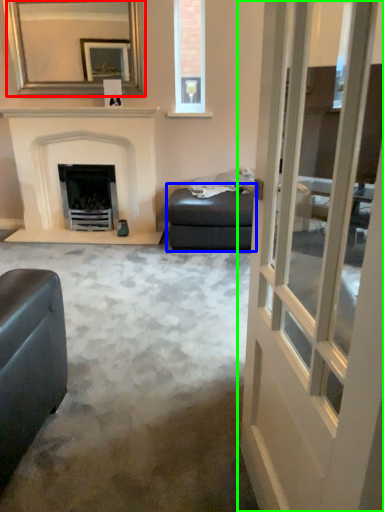
Question: Which is nearer to the mirror (highlighted by a red box)? footrest (highlighted by a blue box) or door (highlighted by a green box).

Choices:
 (A) footrest
 (B) door

Answer: (A)